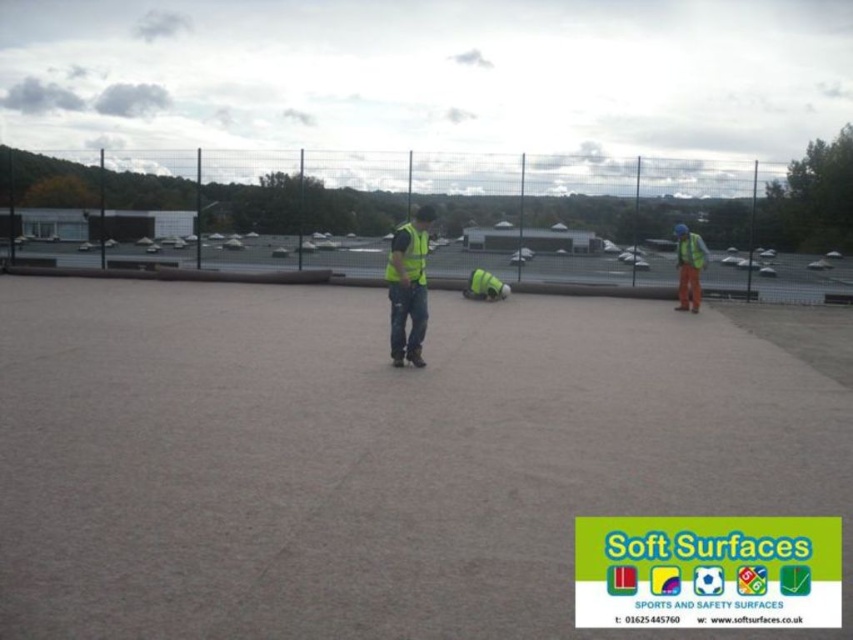
Question: Which point is closer to the camera?

Choices:
 (A) (404, 266)
 (B) (688, 269)

Answer: (A)

Question: Which object is closer to the camera taking this photo?

Choices:
 (A) yellow reflective safety vest at center
 (B) high visibility fabric safety vest at right

Answer: (A)

Question: Is gray concrete parking lot at center bigger than yellow reflective safety vest at right?

Choices:
 (A) no
 (B) yes

Answer: (B)

Question: Is gray concrete parking lot at center further to the viewer compared to yellow reflective safety vest at right?

Choices:
 (A) yes
 (B) no

Answer: (A)

Question: Does yellow reflective safety vest at center lie behind yellow reflective safety vest at right?

Choices:
 (A) no
 (B) yes

Answer: (A)

Question: Among these objects, which one is nearest to the camera?

Choices:
 (A) high visibility vest at center
 (B) high visibility fabric safety vest at right
 (C) gray concrete parking lot at center

Answer: (A)